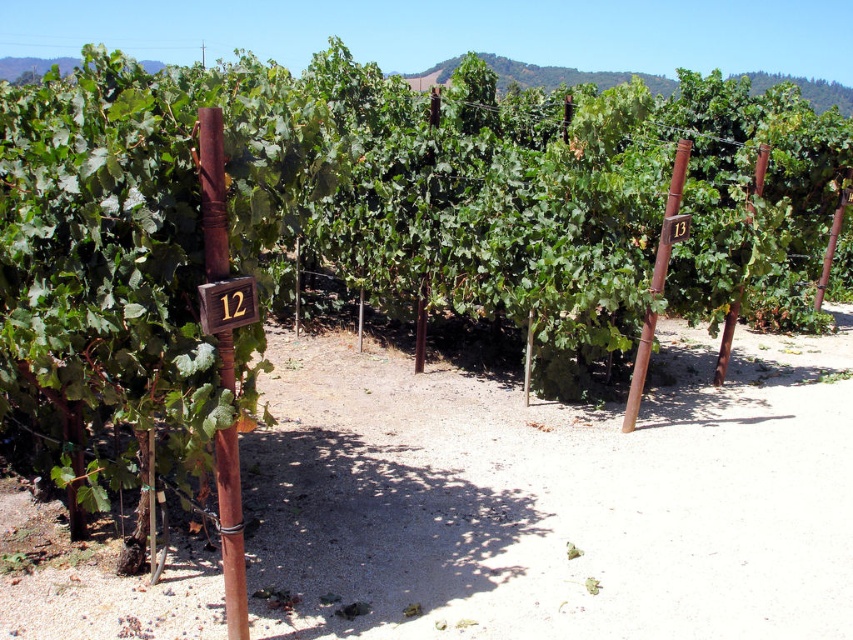
Question: Which point is closer to the camera?

Choices:
 (A) (233, 637)
 (B) (724, 368)
 (C) (682, 157)

Answer: (A)

Question: Which object appears farthest from the camera in this image?

Choices:
 (A) rusty wood pole at center-left
 (B) rustic wood pole at right
 (C) rusty wood pole at center right

Answer: (B)

Question: Can you confirm if wooden sign at center is thinner than rustic wood pole at right?

Choices:
 (A) yes
 (B) no

Answer: (A)

Question: Is the position of rusty wood pole at center right more distant than that of wooden sign at center?

Choices:
 (A) yes
 (B) no

Answer: (A)

Question: Estimate the real-world distances between objects in this image. Which object is farther from the wooden sign at center?

Choices:
 (A) rustic wood pole at right
 (B) rusty wood pole at center-left
 (C) rustic wood pole at center-right
 (D) rusty wood pole at center right

Answer: (A)

Question: Considering the relative positions of wooden sign at center and rustic wood pole at right in the image provided, where is wooden sign at center located with respect to rustic wood pole at right?

Choices:
 (A) left
 (B) right

Answer: (A)